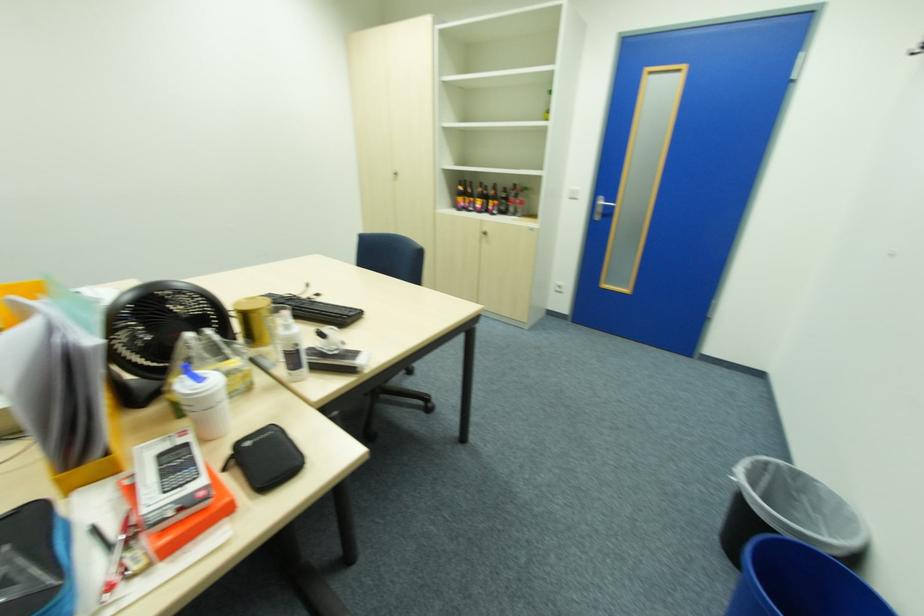
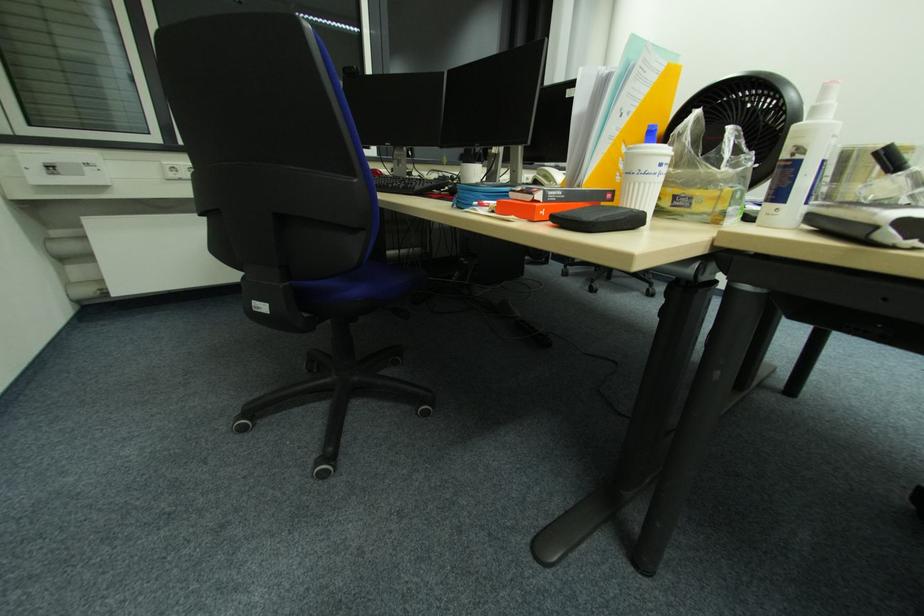
Looking at this image, the images are taken continuously from a first-person perspective. In which direction is your viewpoint rotating?

The rotation direction of the camera is left-down.